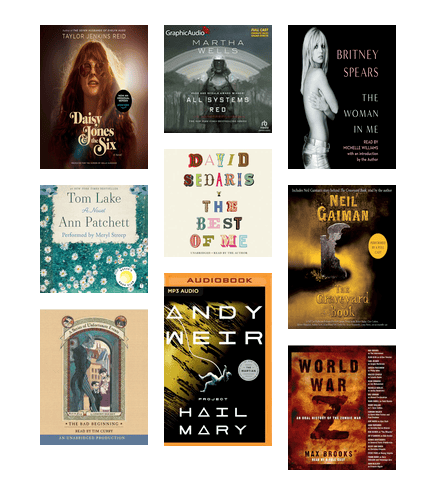
The width and height of the screenshot is (436, 495). Identify the location of books. (94, 101), (207, 85), (350, 109), (98, 227), (222, 205), (341, 251), (88, 356), (221, 365), (344, 416).